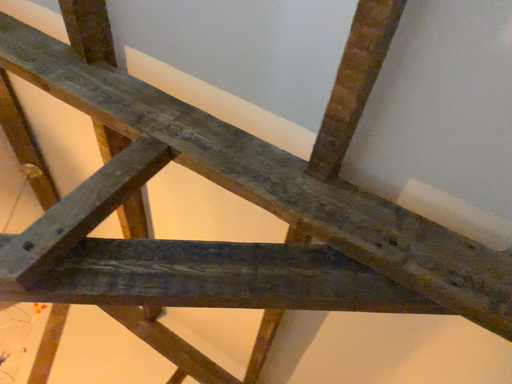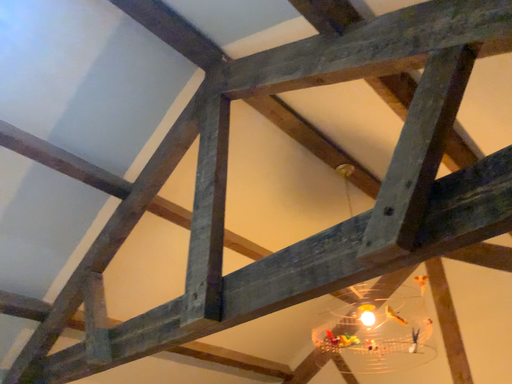
Question: How did the camera likely rotate when shooting the video?

Choices:
 (A) rotated left
 (B) rotated right

Answer: (A)